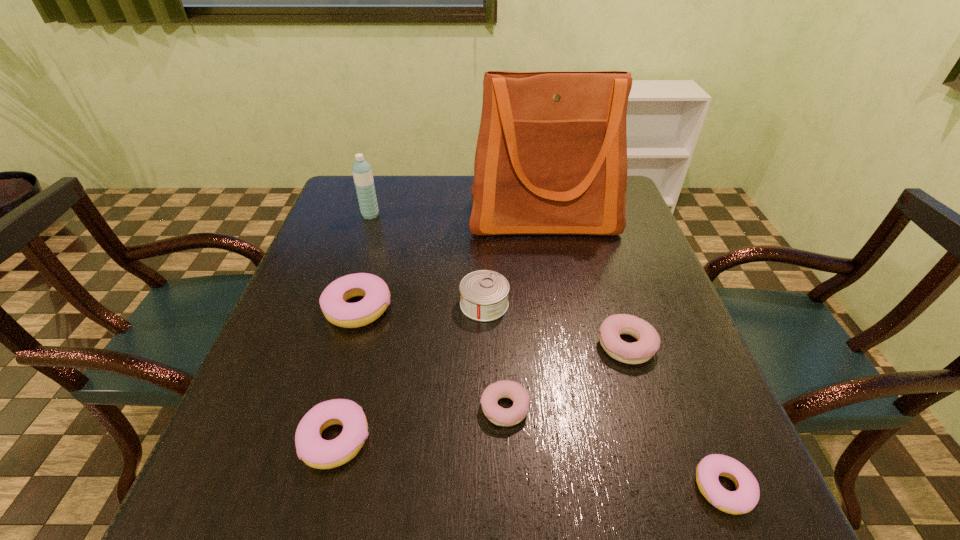
The width and height of the screenshot is (960, 540). I want to click on vacant space that's between the farthest pink doughnut and the seventh shortest object, so click(364, 261).

Identify the location of unoccupied area between the third doughnut from right to left and the second smallest pink doughnut. (420, 424).

This screenshot has height=540, width=960. I want to click on vacant area between the farther purple doughnut and the third doughnut from right to left, so click(x=565, y=376).

This screenshot has height=540, width=960. In order to click on object that is the nearest to the second biggest pink doughnut in this screenshot , I will do `click(375, 291)`.

Find the location of a particular element. the second closest object to the nearer purple doughnut is located at coordinates pos(484,293).

The image size is (960, 540). In order to click on doughnut object that ranks as the second closest to the smallest pink doughnut in this screenshot , I will do `click(498, 415)`.

You are a GUI agent. You are given a task and a screenshot of the screen. Output one action in this format:
    pyautogui.click(x=<x>, y=<y>)
    Task: Click on the closest doughnut to the brown shopping bag
    
    Given the screenshot: What is the action you would take?
    pyautogui.click(x=375, y=291)

Locate which pink doughnut is the second closest to the farthest pink doughnut. Please provide its 2D coordinates. Your answer should be formatted as a tuple, i.e. [(x, y)], where the tuple contains the x and y coordinates of a point satisfying the conditions above.

[(743, 500)]

Choose which pink doughnut is the second nearest neighbor to the second biggest pink doughnut. Please provide its 2D coordinates. Your answer should be formatted as a tuple, i.e. [(x, y)], where the tuple contains the x and y coordinates of a point satisfying the conditions above.

[(743, 500)]

In order to click on vacant space that satisfies the following two spatial constraints: 1. on the back side of the second smallest pink doughnut; 2. on the left side of the smaller purple doughnut in this screenshot , I will do (x=344, y=408).